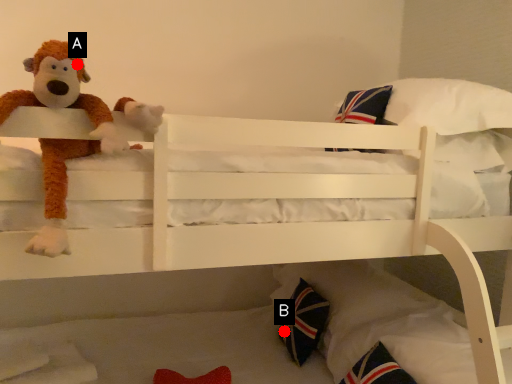
Question: Two points are circled on the image, labeled by A and B beside each circle. Among these points, which one is farthest from the camera?

Choices:
 (A) A is further
 (B) B is further

Answer: (B)